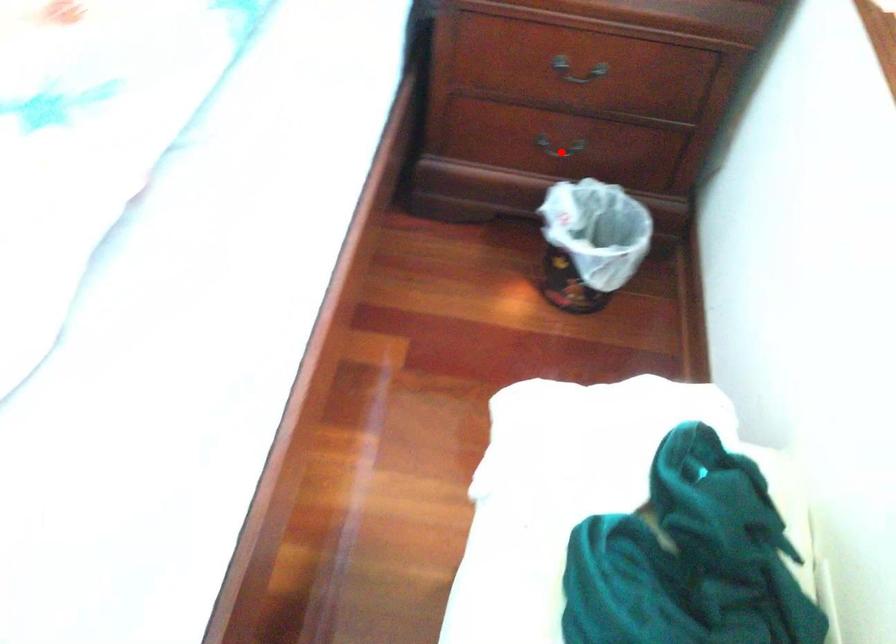
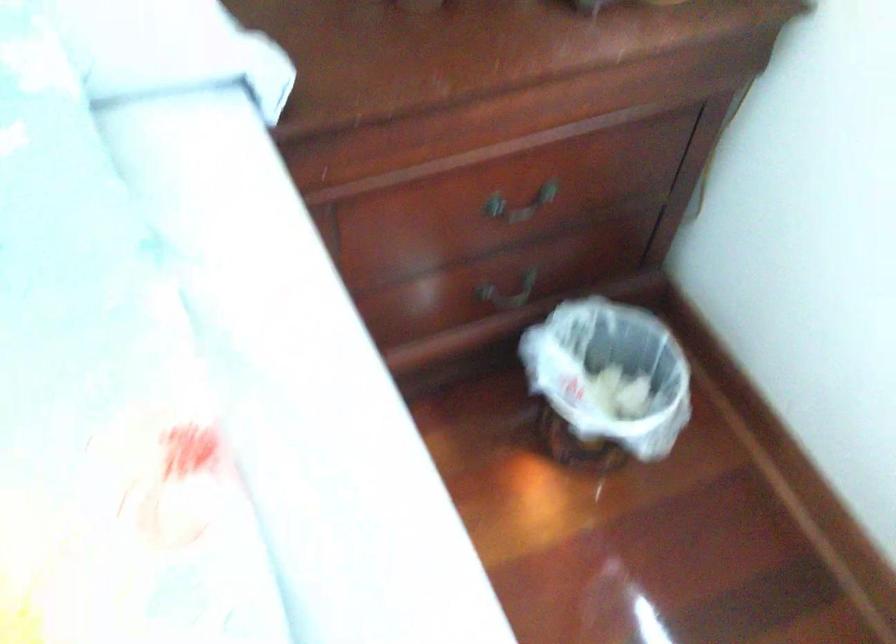
Question: A red point is marked in image1. In image2, is the corresponding 3D point closer to the camera or farther? Reply with the corresponding letter.

Choices:
 (A) The corresponding 3D point is closer.
 (B) The corresponding 3D point is farther.

Answer: (A)